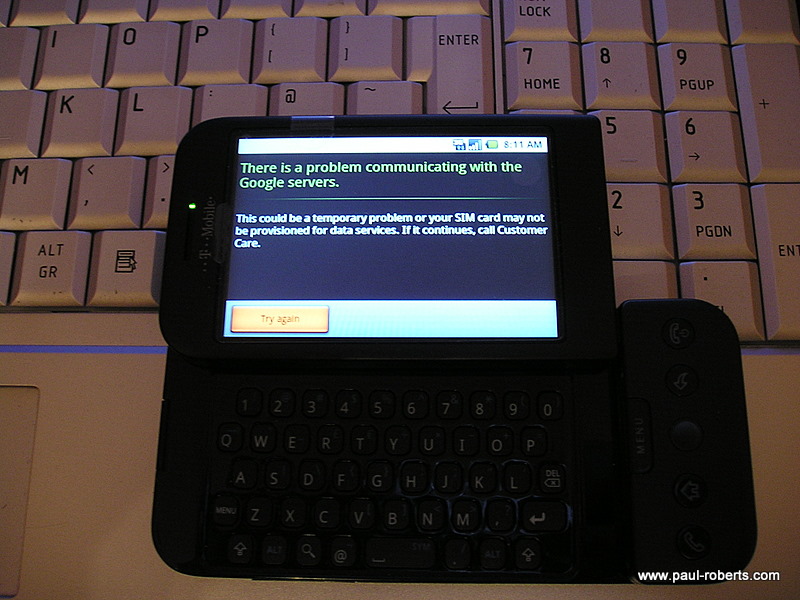
The image size is (800, 600). In order to click on phone screen in this screenshot , I will do `click(441, 261)`.